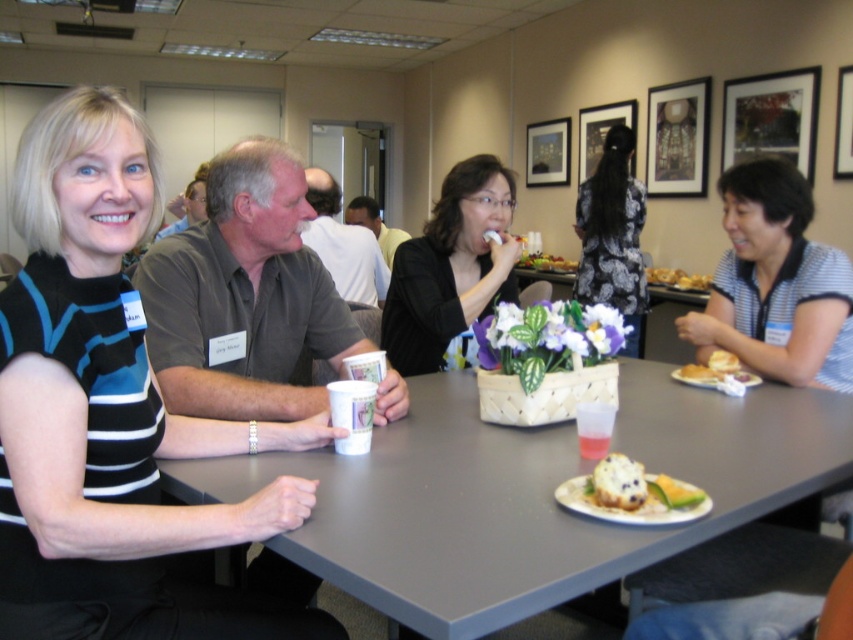
Does black textured dress at center appear over light brown shirt at center?

No, black textured dress at center is not above light brown shirt at center.

Is point (618, 273) closer to camera compared to point (374, 205)?

Yes, it is in front of point (374, 205).

This screenshot has width=853, height=640. Find the location of `black textured dress at center`. black textured dress at center is located at coordinates (612, 236).

Can you confirm if blue striped shirt at right is positioned above black matte jacket at center?

Actually, blue striped shirt at right is below black matte jacket at center.

Is blue striped shirt at right to the left of black matte jacket at center from the viewer's perspective?

Incorrect, blue striped shirt at right is not on the left side of black matte jacket at center.

Locate an element on the screen. This screenshot has width=853, height=640. blue striped shirt at right is located at coordinates (776, 284).

Is point (355, 205) closer to viewer compared to point (689, 500)?

No.

This screenshot has height=640, width=853. Find the location of `light brown shirt at center`. light brown shirt at center is located at coordinates (374, 225).

Is point (372, 220) closer to camera compared to point (645, 480)?

No, it is behind (645, 480).

Find the location of a particular element. Image resolution: width=853 pixels, height=640 pixels. light brown shirt at center is located at coordinates (374, 225).